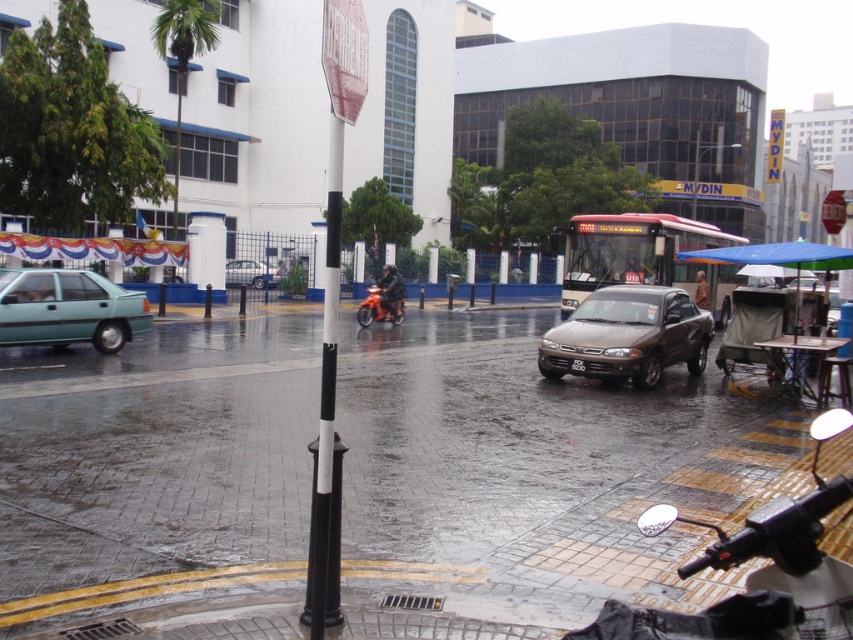
Question: Among these objects, which one is nearest to the camera?

Choices:
 (A) teal matte sedan at left
 (B) metallic silver car at center
 (C) orange matte motorcycle at center
 (D) satin brown sedan at center

Answer: (D)

Question: Is teal matte sedan at left to the right of metallic silver car at center from the viewer's perspective?

Choices:
 (A) no
 (B) yes

Answer: (B)

Question: Which object is the closest to the metallic silver car at center?

Choices:
 (A) teal matte sedan at left
 (B) satin brown sedan at center

Answer: (A)

Question: Can you confirm if orange matte motorcycle at center is positioned to the left of metallic silver car at center?

Choices:
 (A) no
 (B) yes

Answer: (A)

Question: Based on their relative distances, which object is nearer to the metallic silver car at center?

Choices:
 (A) satin brown sedan at center
 (B) orange matte motorcycle at center

Answer: (B)

Question: Is satin brown sedan at center wider than orange matte motorcycle at center?

Choices:
 (A) no
 (B) yes

Answer: (B)